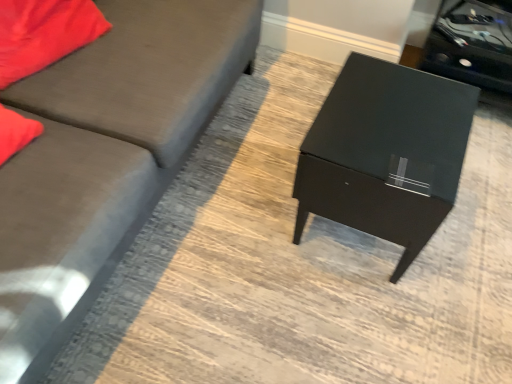
Question: Is matte red pillow at upper left wider than matte gray couch at left?

Choices:
 (A) yes
 (B) no

Answer: (B)

Question: Is the position of matte red pillow at upper left more distant than that of matte gray couch at left?

Choices:
 (A) yes
 (B) no

Answer: (A)

Question: Does matte red pillow at upper left appear on the right side of matte gray couch at left?

Choices:
 (A) yes
 (B) no

Answer: (B)

Question: Is matte red pillow at upper left bigger than matte gray couch at left?

Choices:
 (A) yes
 (B) no

Answer: (B)

Question: Does matte red pillow at upper left have a greater height compared to matte gray couch at left?

Choices:
 (A) no
 (B) yes

Answer: (A)

Question: Is matte gray couch at left a part of matte red pillow at upper left?

Choices:
 (A) yes
 (B) no

Answer: (B)

Question: From a real-world perspective, is black glossy side table at upper right physically below matte gray couch at left?

Choices:
 (A) yes
 (B) no

Answer: (A)

Question: From a real-world perspective, is black glossy side table at upper right on matte gray couch at left?

Choices:
 (A) yes
 (B) no

Answer: (B)

Question: Is black glossy side table at upper right placed right next to matte gray couch at left?

Choices:
 (A) no
 (B) yes

Answer: (A)

Question: Is black glossy side table at upper right surrounding matte gray couch at left?

Choices:
 (A) yes
 (B) no

Answer: (B)

Question: From the image's perspective, is black glossy side table at upper right on matte gray couch at left?

Choices:
 (A) yes
 (B) no

Answer: (A)

Question: Can you confirm if black glossy side table at upper right is smaller than matte gray couch at left?

Choices:
 (A) yes
 (B) no

Answer: (A)

Question: Is matte black table at center looking in the opposite direction of matte gray couch at left?

Choices:
 (A) yes
 (B) no

Answer: (B)